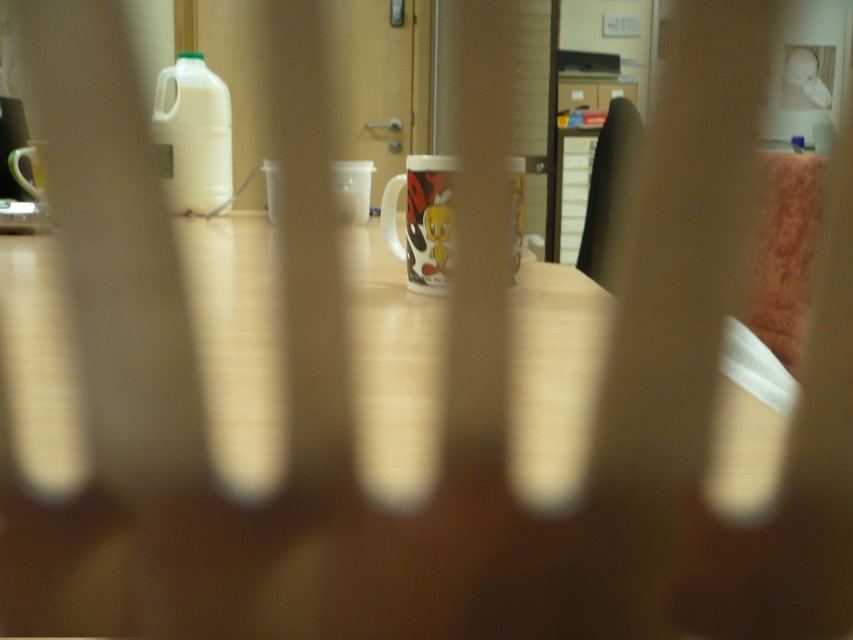
Describe the element at coordinates (422, 220) in the screenshot. The width and height of the screenshot is (853, 640). I see `glossy ceramic mug at center` at that location.

Which is behind, point (440, 241) or point (16, 168)?

Positioned behind is point (16, 168).

Does point (438, 289) come farther from viewer compared to point (44, 195)?

No, (438, 289) is closer to viewer.

In order to click on glossy ceramic mug at center in this screenshot , I will do `click(422, 220)`.

Who is shorter, glossy ceramic mug at center or brown leather chair at right?

Standing shorter between the two is glossy ceramic mug at center.

Does point (438, 284) come in front of point (584, 268)?

Yes.

Is point (422, 168) less distant than point (611, 180)?

Yes, it is in front of point (611, 180).

Locate an element on the screen. glossy ceramic mug at center is located at coordinates (422, 220).

Between wooden table at center and glossy ceramic mug at center, which one appears on the left side from the viewer's perspective?

wooden table at center

What are the coordinates of `wooden table at center` in the screenshot? It's located at (236, 342).